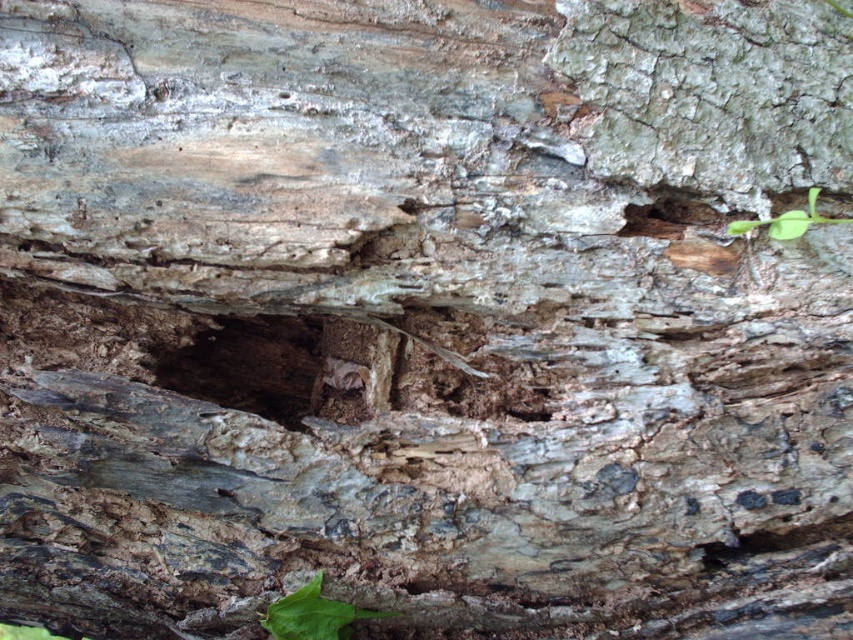
You are a gardener assessing the health of plants in a forest. You notice two green leafy plants growing near the decayed tree trunk. Which of the two plants, the green leafy plant at lower center or the green leafy plant at upper right, is taller?

The green leafy plant at lower center is taller than the green leafy plant at upper right according to the description provided.